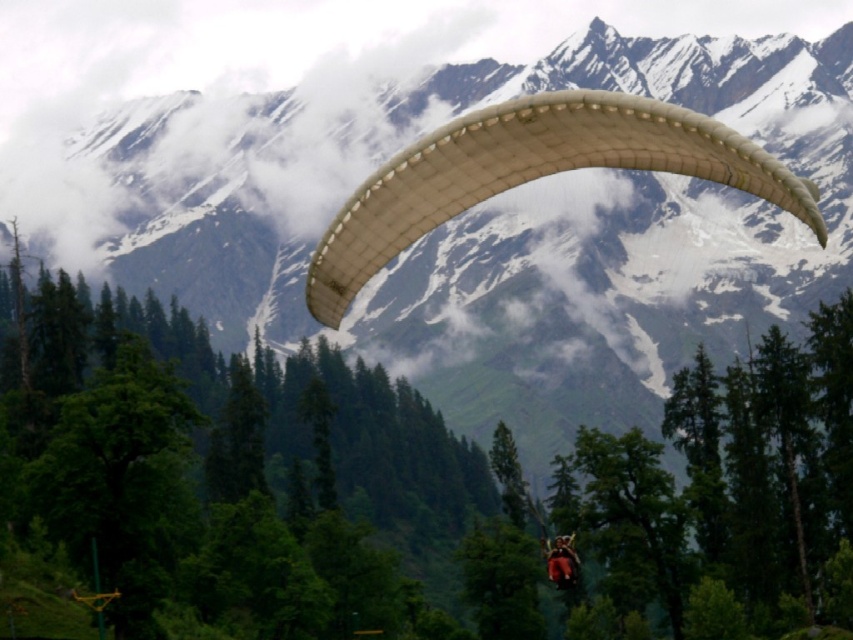
Question: Is white fabric parachute at upper center positioned at the back of white fabric parachute at center?

Choices:
 (A) yes
 (B) no

Answer: (A)

Question: Does white fabric parachute at center have a larger size compared to matte white paraglider at center?

Choices:
 (A) no
 (B) yes

Answer: (B)

Question: Which point is closer to the camera?

Choices:
 (A) white fabric parachute at upper center
 (B) white fabric parachute at center
 (C) matte white paraglider at center

Answer: (B)

Question: Which of these objects is positioned closest to the white fabric parachute at center?

Choices:
 (A) matte white paraglider at center
 (B) white fabric parachute at upper center

Answer: (A)

Question: Among these objects, which one is nearest to the camera?

Choices:
 (A) matte white paraglider at center
 (B) white fabric parachute at center

Answer: (B)

Question: From the image, what is the correct spatial relationship of white fabric parachute at center in relation to matte white paraglider at center?

Choices:
 (A) left
 (B) right

Answer: (A)